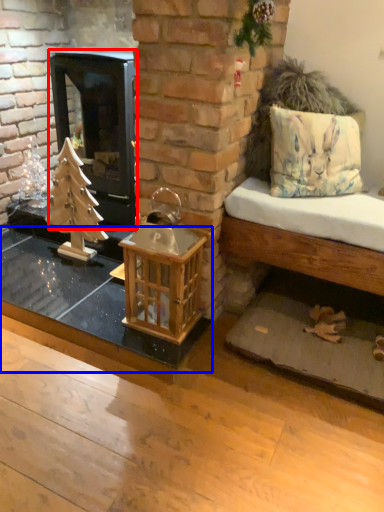
Question: Which point is closer to the camera, wood burning stove (highlighted by a red box) or table (highlighted by a blue box)?

Choices:
 (A) wood burning stove
 (B) table

Answer: (B)